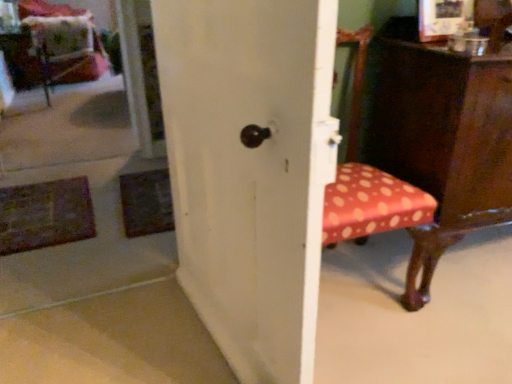
Question: In terms of height, does velvet cushion at upper left look taller or shorter compared to polka dot fabric chair at right?

Choices:
 (A) short
 (B) tall

Answer: (A)

Question: Is velvet cushion at upper left situated inside polka dot fabric chair at right or outside?

Choices:
 (A) outside
 (B) inside

Answer: (A)

Question: Estimate the real-world distances between objects in this image. Which object is farther from the velvet cushion at upper left?

Choices:
 (A) polka dot fabric chair at right
 (B) velvet polka dot swivel chair at upper left
 (C) white matte door at center
 (D) wooden picture frame at upper right

Answer: (D)

Question: Estimate the real-world distances between objects in this image. Which object is closer to the velvet polka dot swivel chair at upper left?

Choices:
 (A) velvet cushion at upper left
 (B) white matte door at center
 (C) polka dot fabric chair at right
 (D) wooden picture frame at upper right

Answer: (A)